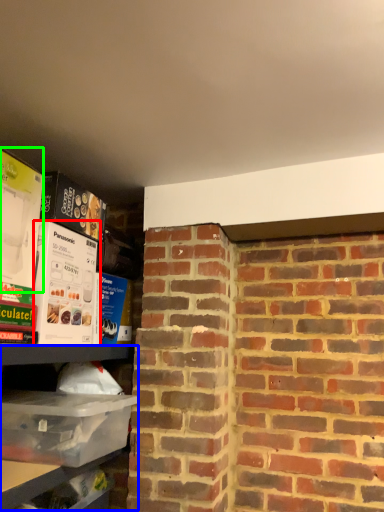
Question: Considering the real-world distances, which object is farthest from box (highlighted by a red box)? shelf (highlighted by a blue box) or box (highlighted by a green box)?

Choices:
 (A) shelf
 (B) box

Answer: (A)